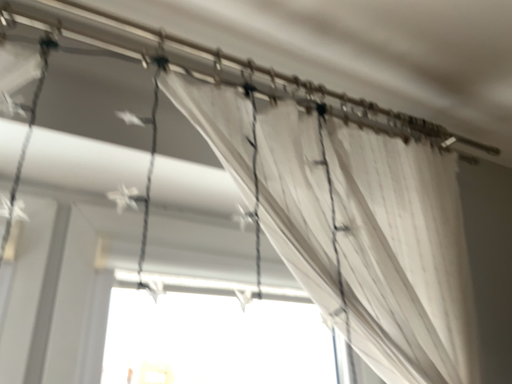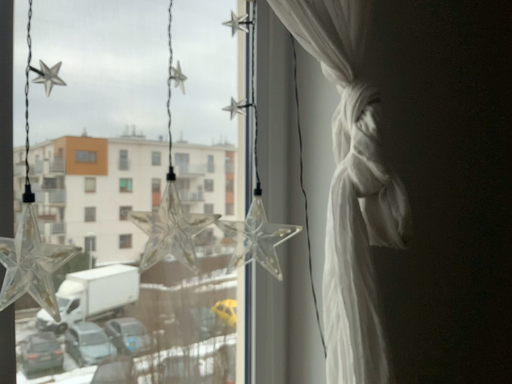
Question: How did the camera likely rotate when shooting the video?

Choices:
 (A) rotated downward
 (B) rotated upward

Answer: (A)